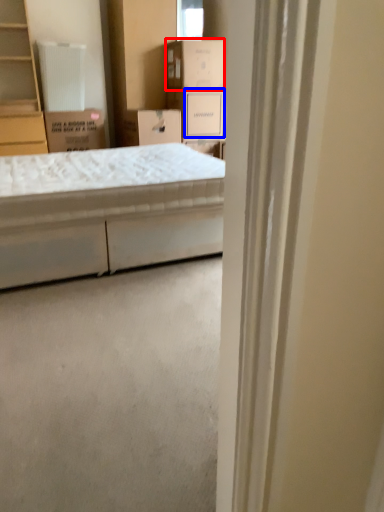
Question: Among these objects, which one is nearest to the camera, cardboard box (highlighted by a red box) or storage box (highlighted by a blue box)?

Choices:
 (A) cardboard box
 (B) storage box

Answer: (A)